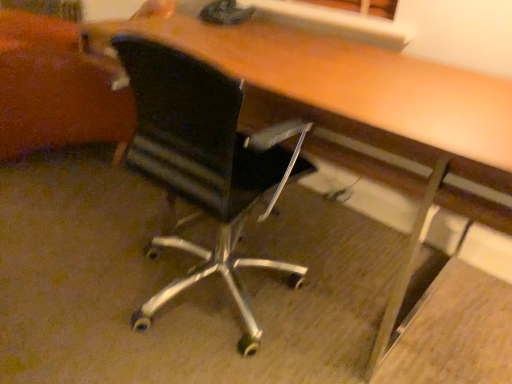
You are a GUI agent. You are given a task and a screenshot of the screen. Output one action in this format:
    pyautogui.click(x=<x>, y=<y>)
    Task: Click on the black leather chair at center
    Image resolution: width=512 pixels, height=384 pixels.
    Given the screenshot: What is the action you would take?
    206,163

Describe the element at coordinates (206, 163) in the screenshot. I see `black leather chair at center` at that location.

What do you see at coordinates (55, 89) in the screenshot?
I see `black mesh swivel chair at left` at bounding box center [55, 89].

At what (x,y) coordinates should I click in order to perform the action: click on black mesh swivel chair at left. Please return your answer as a coordinate pair (x, y). The width and height of the screenshot is (512, 384). Looking at the image, I should click on (55, 89).

You are a GUI agent. You are given a task and a screenshot of the screen. Output one action in this format:
    pyautogui.click(x=<x>, y=<y>)
    Task: Click on the black leather chair at center
    
    Given the screenshot: What is the action you would take?
    pyautogui.click(x=206, y=163)

Is black leather chair at center at the right side of black mesh swivel chair at left?

Indeed, black leather chair at center is positioned on the right side of black mesh swivel chair at left.

Looking at this image, is black leather chair at center further to the viewer compared to black mesh swivel chair at left?

No, black leather chair at center is closer to the camera.

Is point (197, 119) farther from viewer compared to point (34, 68)?

No, it is in front of (34, 68).

From the image's perspective, is black leather chair at center located beneath black mesh swivel chair at left?

Indeed, from the image's perspective, black leather chair at center is shown beneath black mesh swivel chair at left.

From a real-world perspective, is black leather chair at center physically located above or below black mesh swivel chair at left?

From a real-world perspective, black leather chair at center is physically above black mesh swivel chair at left.

Is black leather chair at center wider or thinner than black mesh swivel chair at left?

Considering their sizes, black leather chair at center looks slimmer than black mesh swivel chair at left.

Which of these two, black leather chair at center or black mesh swivel chair at left, stands shorter?

Standing shorter between the two is black mesh swivel chair at left.

Between black leather chair at center and black mesh swivel chair at left, which one has larger size?

Bigger between the two is black mesh swivel chair at left.

Is black leather chair at center spatially inside black mesh swivel chair at left, or outside of it?

black leather chair at center is spatially situated outside black mesh swivel chair at left.

Is there a large distance between black leather chair at center and black mesh swivel chair at left?

Actually, black leather chair at center and black mesh swivel chair at left are a little close together.

Is black leather chair at center turned away from black mesh swivel chair at left?

black leather chair at center is not turned away from black mesh swivel chair at left.

How many degrees apart are the facing directions of black leather chair at center and black mesh swivel chair at left?

141 degrees separate the facing orientations of black leather chair at center and black mesh swivel chair at left.

Locate an element on the screen. swivel chair behind the black leather chair at center is located at coordinates click(x=55, y=89).

Does black mesh swivel chair at left appear on the left side of black leather chair at center?

Yes.

Is black mesh swivel chair at left further to camera compared to black leather chair at center?

Yes, the depth of black mesh swivel chair at left is greater than that of black leather chair at center.

Does point (23, 147) come farther from viewer compared to point (229, 165)?

That is True.

From the image's perspective, is black mesh swivel chair at left below black leather chair at center?

No.

From a real-world perspective, is black mesh swivel chair at left above or below black leather chair at center?

black mesh swivel chair at left is situated lower than black leather chair at center in the real world.

Between black mesh swivel chair at left and black leather chair at center, which one has larger width?

Wider between the two is black mesh swivel chair at left.

Is black mesh swivel chair at left taller than black leather chair at center?

No.

Does black mesh swivel chair at left have a smaller size compared to black leather chair at center?

Actually, black mesh swivel chair at left might be larger than black leather chair at center.

Which is correct: black mesh swivel chair at left is inside black leather chair at center, or outside of it?

black mesh swivel chair at left exists outside the volume of black leather chair at center.

Would you consider black mesh swivel chair at left to be distant from black leather chair at center?

No, there isn't a large distance between black mesh swivel chair at left and black leather chair at center.

Could you tell me if black mesh swivel chair at left is facing black leather chair at center?

No.

What's the angular difference between black mesh swivel chair at left and black leather chair at center's facing directions?

141 degrees separate the facing orientations of black mesh swivel chair at left and black leather chair at center.

The image size is (512, 384). In order to click on swivel chair above the black leather chair at center (from the image's perspective) in this screenshot , I will do `click(55, 89)`.

At what (x,y) coordinates should I click in order to perform the action: click on swivel chair behind the black leather chair at center. Please return your answer as a coordinate pair (x, y). Image resolution: width=512 pixels, height=384 pixels. Looking at the image, I should click on (55, 89).

The height and width of the screenshot is (384, 512). There is a black mesh swivel chair at left. What are the coordinates of `chair above it (from a real-world perspective)` in the screenshot? It's located at (206, 163).